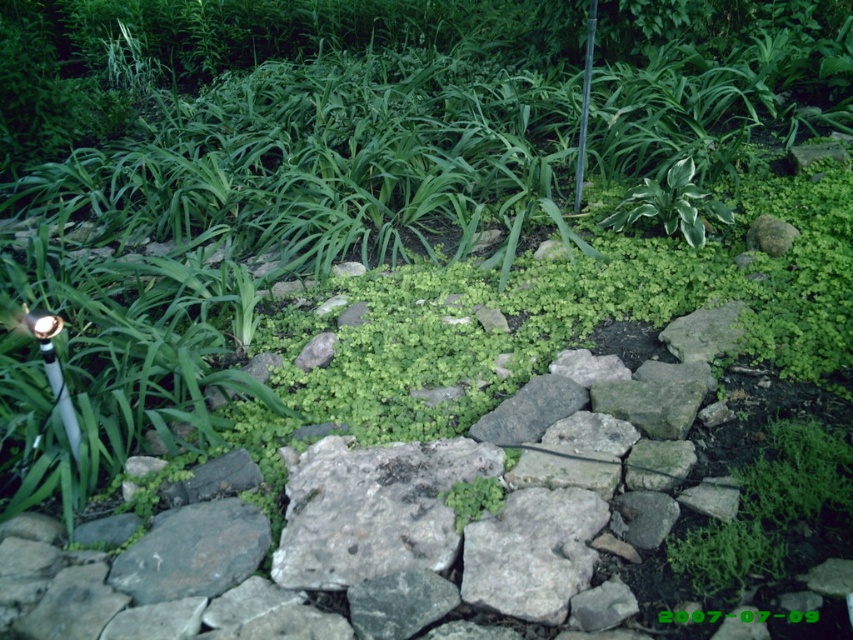
Question: Is gray rough rock at center positioned behind white-green leafy plant at upper right?

Choices:
 (A) no
 (B) yes

Answer: (A)

Question: In this image, where is gray rough rock at center located relative to white-green leafy plant at upper right?

Choices:
 (A) above
 (B) below

Answer: (B)

Question: Which of the following is the closest to the observer?

Choices:
 (A) gray rough rock at center
 (B) white-green leafy plant at upper right

Answer: (A)

Question: In this image, where is gray rough rock at center located relative to white-green leafy plant at upper right?

Choices:
 (A) left
 (B) right

Answer: (A)

Question: Which object appears farthest from the camera in this image?

Choices:
 (A) white-green leafy plant at upper right
 (B) gray rough rock at center

Answer: (A)

Question: Which point is farther from the camera taking this photo?

Choices:
 (A) (677, 225)
 (B) (213, 547)

Answer: (A)